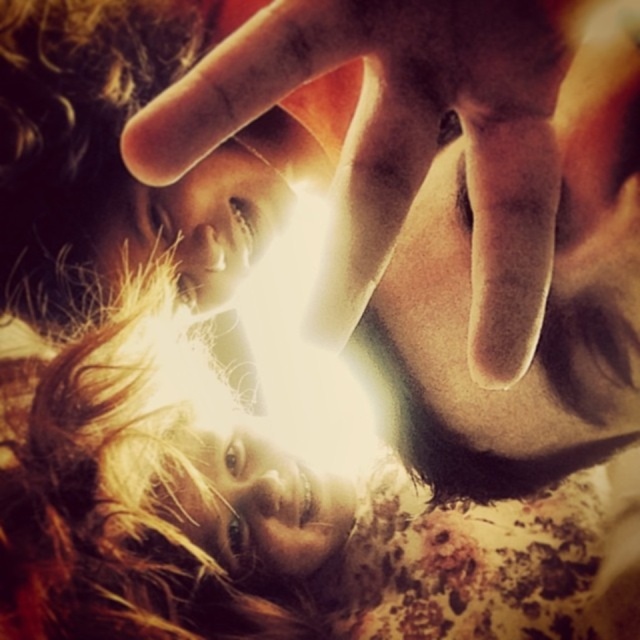
Between blonde hair at center and smooth skin hand at center, which one has more height?

blonde hair at center is taller.

Does point (544, 609) come in front of point (506, 113)?

That is False.

The image size is (640, 640). Find the location of `blonde hair at center`. blonde hair at center is located at coordinates (243, 509).